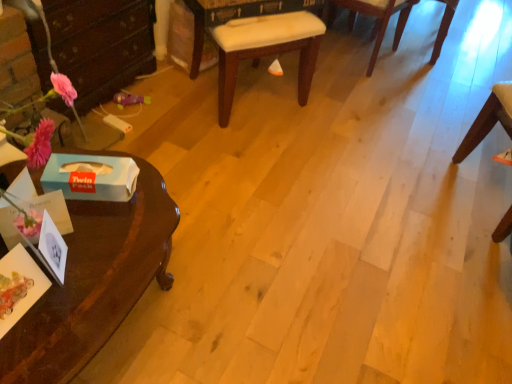
Identify the location of vacant space that's between glossy dark wood desk at left and wooden chair at upper right, the third chair in the left-to-right sequence. (313, 134).